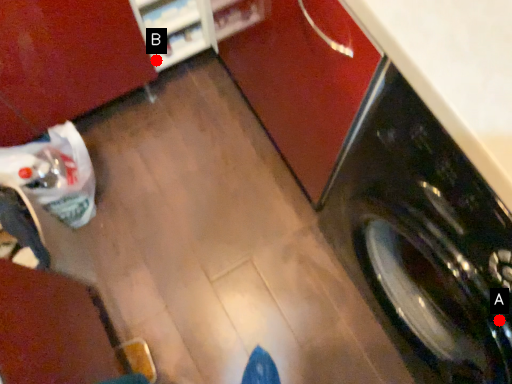
Question: Two points are circled on the image, labeled by A and B beside each circle. Which point is closer to the camera?

Choices:
 (A) A is closer
 (B) B is closer

Answer: (A)